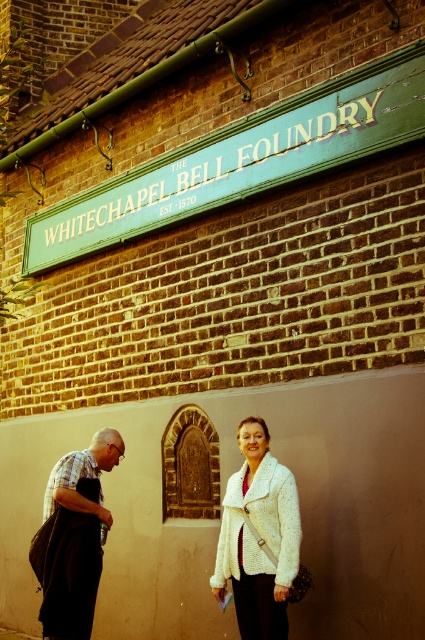
You are standing in front of the Whitechapel Bell Foundry and see a white textured sweater at center and a white fluffy coat at lower center. Which one is taller?

The white textured sweater at center is much taller than the white fluffy coat at lower center.